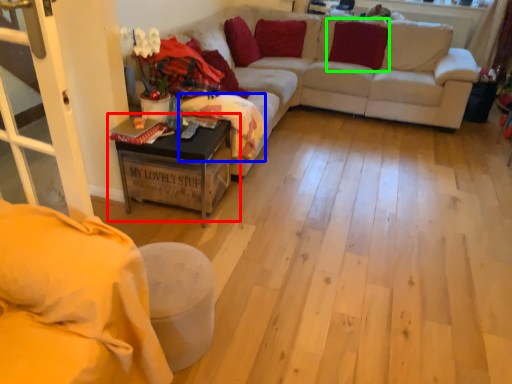
Question: Which is nearer to the table (highlighted by a red box)? blanket (highlighted by a blue box) or pillow (highlighted by a green box).

Choices:
 (A) blanket
 (B) pillow

Answer: (A)